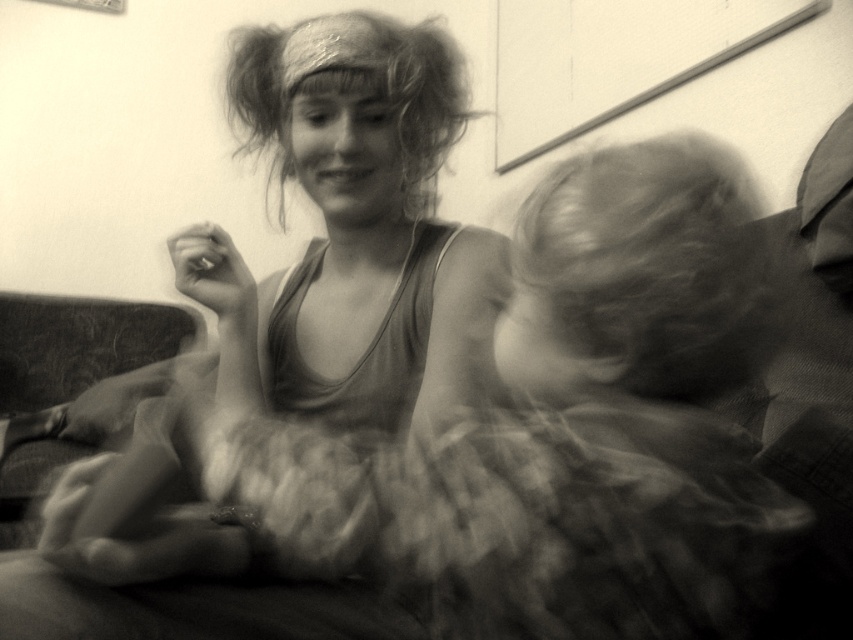
What is the object located at the coordinates point (347,230) in the image?

The object located at point (347,230) is the matte fabric dress at center.

You are standing in front of the couch where the two people are sitting. You need to place a small vase exactly at the center of the couch. According to the image, where should you place the vase relative to the smooth fabric dress at center?

The smooth fabric dress at center is located at point (563, 428), so you should place the vase at the center of the couch, which is different from the dress position.